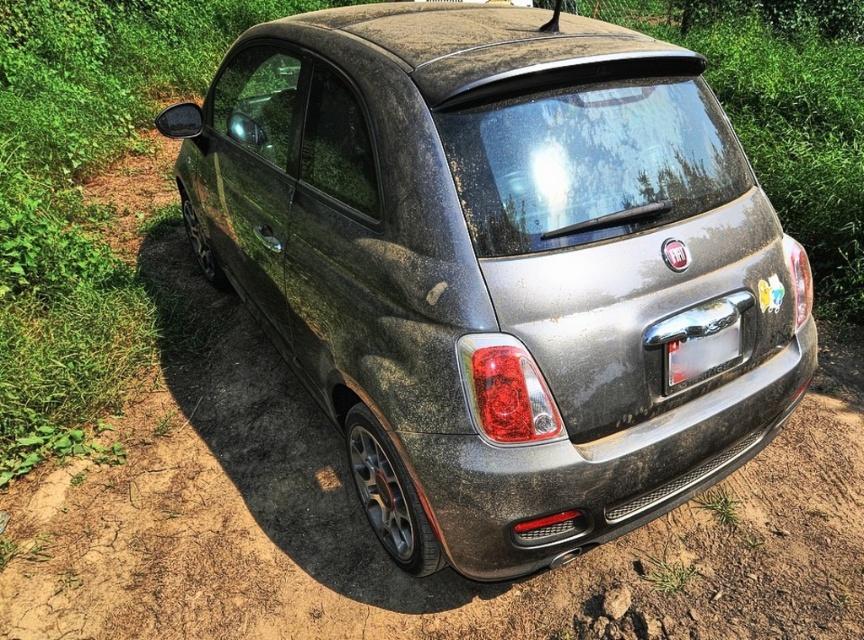
Question: Which point is closer to the camera taking this photo?

Choices:
 (A) (741, 355)
 (B) (426, 296)

Answer: (B)

Question: Is the position of dusty metallic car at center more distant than that of transparent plastic license plate at center?

Choices:
 (A) yes
 (B) no

Answer: (B)

Question: Does dusty metallic car at center have a greater width compared to transparent plastic license plate at center?

Choices:
 (A) no
 (B) yes

Answer: (B)

Question: Can you confirm if dusty metallic car at center is thinner than transparent plastic license plate at center?

Choices:
 (A) yes
 (B) no

Answer: (B)